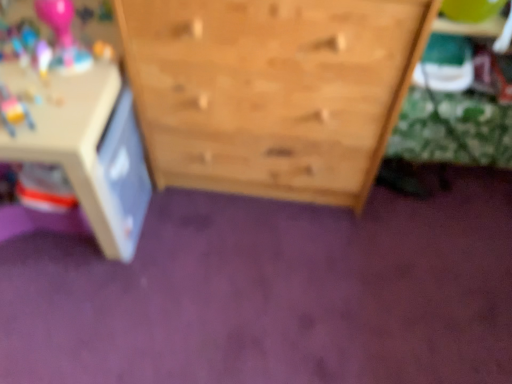
Question: Considering the relative positions of white plastic table at left and natural wood chest of drawers at center in the image provided, is white plastic table at left to the left or to the right of natural wood chest of drawers at center?

Choices:
 (A) left
 (B) right

Answer: (A)

Question: From a real-world perspective, is white plastic table at left physically located above or below natural wood chest of drawers at center?

Choices:
 (A) above
 (B) below

Answer: (B)

Question: From the image's perspective, is white plastic table at left positioned above or below natural wood chest of drawers at center?

Choices:
 (A) below
 (B) above

Answer: (A)

Question: From the image's perspective, relative to white plastic table at left, is natural wood chest of drawers at center above or below?

Choices:
 (A) above
 (B) below

Answer: (A)

Question: Based on their sizes in the image, would you say natural wood chest of drawers at center is bigger or smaller than white plastic table at left?

Choices:
 (A) big
 (B) small

Answer: (A)

Question: Is point (267, 74) positioned closer to the camera than point (99, 200)?

Choices:
 (A) closer
 (B) farther

Answer: (A)

Question: Is natural wood chest of drawers at center in front of or behind white plastic table at left in the image?

Choices:
 (A) front
 (B) behind

Answer: (A)